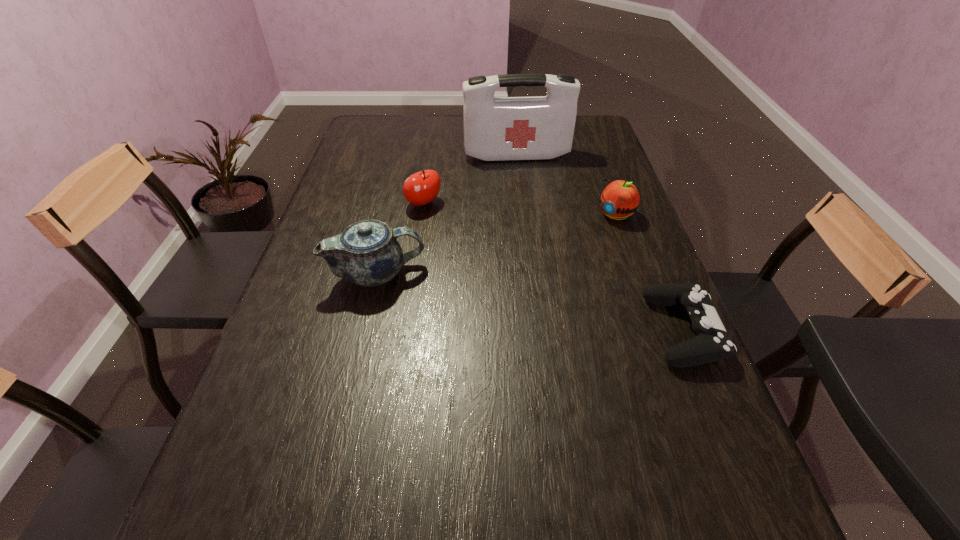
Identify the location of free space on the desktop that is between the chinaware and the control and is positioned on the stem of the left apple. Image resolution: width=960 pixels, height=540 pixels. (525, 301).

Identify the location of free space on the desktop that is between the chinaware and the shortest object and is positioned on the surface of the right apple. coord(502,296).

At what (x,y) coordinates should I click in order to perform the action: click on vacant space on the desktop that is between the second tallest object and the control and is positioned on the front side of the first-aid kit. Please return your answer as a coordinate pair (x, y). This screenshot has height=540, width=960. Looking at the image, I should click on (550, 306).